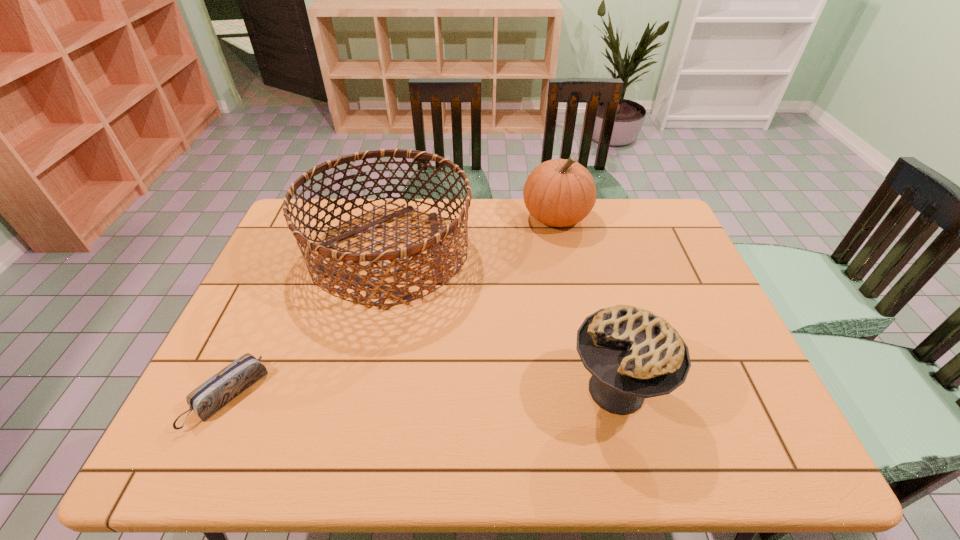
Image resolution: width=960 pixels, height=540 pixels. In order to click on free space at the left edge of the desktop in this screenshot , I will do `click(250, 390)`.

I want to click on free space at the right edge of the desktop, so click(x=732, y=346).

This screenshot has height=540, width=960. In order to click on vacant space at the near left corner of the desktop in this screenshot , I will do `click(186, 446)`.

Find the location of a particular element. The width and height of the screenshot is (960, 540). vacant area that lies between the pie and the pumpkin is located at coordinates (587, 303).

Find the location of a particular element. Image resolution: width=960 pixels, height=540 pixels. vacant point located between the pie and the pumpkin is located at coordinates [x=587, y=303].

Find the location of a particular element. vacant area that lies between the pumpkin and the pie is located at coordinates (587, 303).

Locate an element on the screen. free space between the basket and the pumpkin is located at coordinates (472, 235).

Locate an element on the screen. The image size is (960, 540). empty location between the pumpkin and the basket is located at coordinates (472, 235).

The image size is (960, 540). Identify the location of blank region between the shortest object and the basket. (309, 325).

The height and width of the screenshot is (540, 960). Find the location of `free space between the pie and the pumpkin`. free space between the pie and the pumpkin is located at coordinates (587, 303).